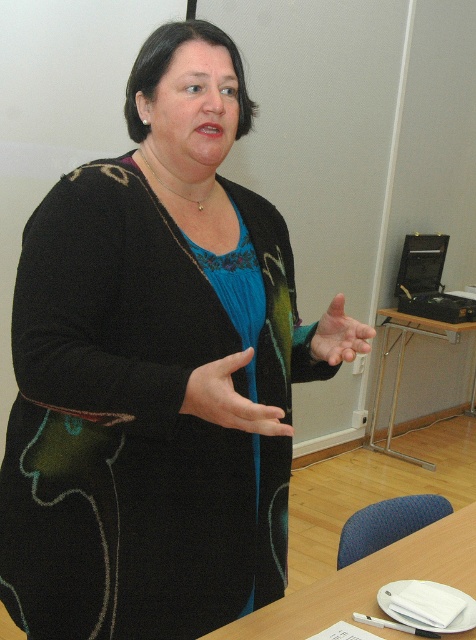
You are standing in the room and see two points marked in the image. Which point, point (x=339, y=589) or point (x=466, y=324), is closer to you?

Point (x=339, y=589) is closer to the viewer than point (x=466, y=324).

You are a photographer setting up for a portrait. You need to ensure the matte black hand at center is visible above the wooden table at lower right. Based on the scene description, will the hand be visible above the table?

The wooden table at lower right has a lesser height compared to matte black hand at center, so the hand will be visible above the table.

You are a person who is 1.6 meters tall. You are standing in front of the wooden table at lower right. Can you reach the top of the table without standing on anything?

The distance between the wooden table at lower right and the camera is 1.07 meters, but this measurement does not provide information about the table height. Therefore, it is impossible to determine if you can reach the top of the table without additional information about its height.